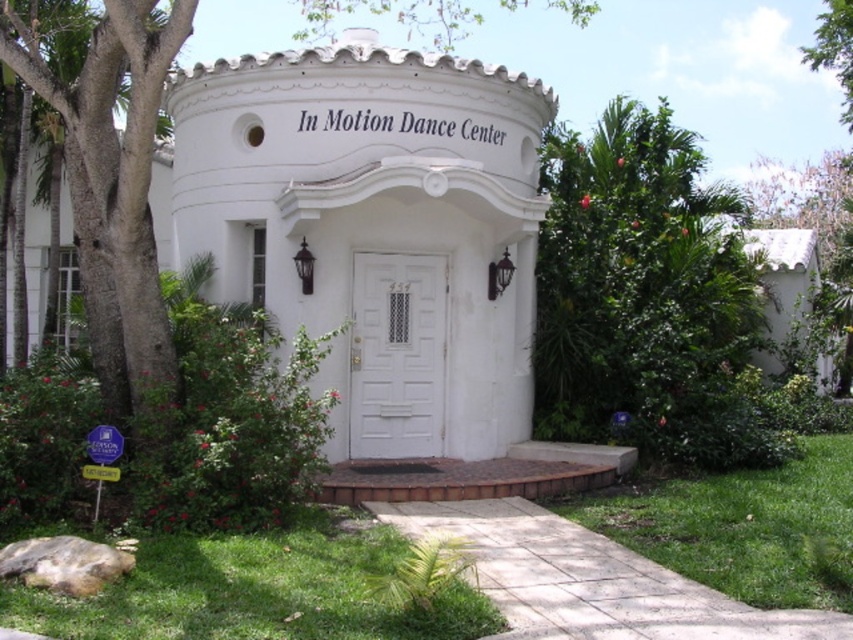
Question: Which point appears closest to the camera in this image?

Choices:
 (A) (415, 419)
 (B) (380, 403)

Answer: (B)

Question: Among these points, which one is farthest from the camera?

Choices:
 (A) (463, 365)
 (B) (405, 340)
 (C) (688, 392)

Answer: (C)

Question: Is green leafy tree at center positioned in front of white wooden door at center?

Choices:
 (A) yes
 (B) no

Answer: (B)

Question: Which point is closer to the camera?

Choices:
 (A) white wooden door at center
 (B) green leafy tree at center

Answer: (A)

Question: Does green leafy tree at center come behind white wooden door at center?

Choices:
 (A) no
 (B) yes

Answer: (B)

Question: From the image, what is the correct spatial relationship of white matte door at center in relation to white wooden door at center?

Choices:
 (A) above
 (B) below

Answer: (A)